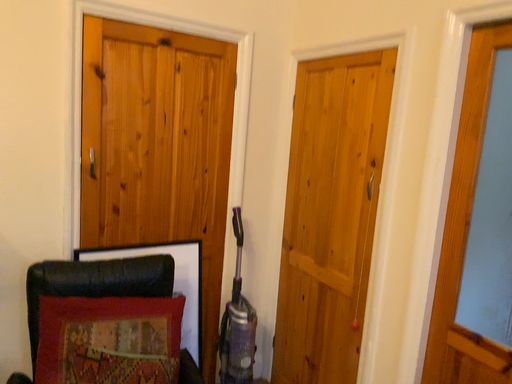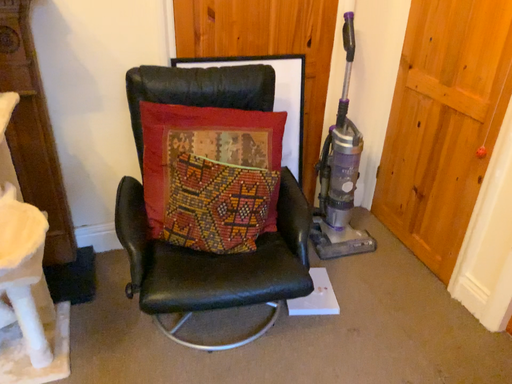
Question: How did the camera likely rotate when shooting the video?

Choices:
 (A) rotated left
 (B) rotated right

Answer: (A)